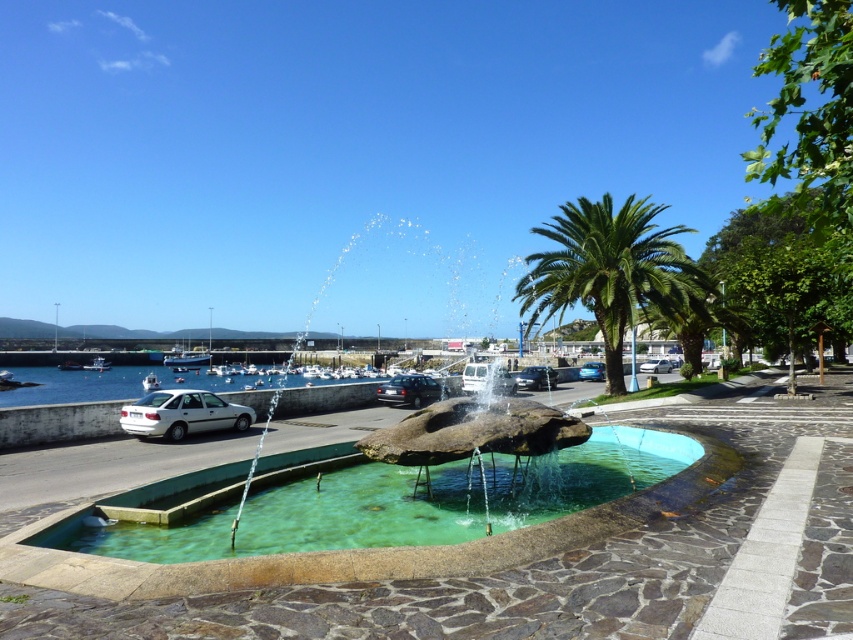
Between satin black car at center and silver metallic van at center, which one has more height?

satin black car at center is taller.

Is satin black car at center wider than silver metallic van at center?

Incorrect, satin black car at center's width does not surpass silver metallic van at center's.

Is point (390, 387) positioned after point (654, 360)?

No.

This screenshot has height=640, width=853. In order to click on satin black car at center in this screenshot , I will do `click(410, 390)`.

Does green stone fountain at center have a larger size compared to blue metallic car at center?

Yes, green stone fountain at center is bigger than blue metallic car at center.

Locate an element on the screen. Image resolution: width=853 pixels, height=640 pixels. green stone fountain at center is located at coordinates (335, 500).

Does blue metallic car at center appear over white plastic boat at center?

Correct, blue metallic car at center is located above white plastic boat at center.

Is blue metallic car at center below white plastic boat at center?

No, blue metallic car at center is not below white plastic boat at center.

Who is more forward, [595,376] or [144,380]?

Positioned in front is point [595,376].

Image resolution: width=853 pixels, height=640 pixels. Find the location of `blue metallic car at center`. blue metallic car at center is located at coordinates (592, 371).